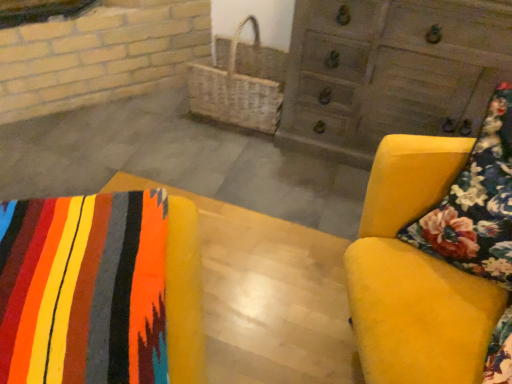
Question: Is woven wicker basket at center oriented towards velvet yellow armchair at right, placed as the 2th furniture when sorted from left to right?

Choices:
 (A) no
 (B) yes

Answer: (A)

Question: Can you confirm if woven wicker basket at center is positioned to the right of velvet yellow armchair at right, placed as the 1th furniture when sorted from right to left?

Choices:
 (A) yes
 (B) no

Answer: (B)

Question: From a real-world perspective, is woven wicker basket at center located beneath velvet yellow armchair at right, placed as the 1th furniture when sorted from right to left?

Choices:
 (A) yes
 (B) no

Answer: (A)

Question: Is woven wicker basket at center positioned before velvet yellow armchair at right, placed as the 1th furniture when sorted from right to left?

Choices:
 (A) no
 (B) yes

Answer: (A)

Question: Is woven wicker basket at center shorter than velvet yellow armchair at right, placed as the 2th furniture when sorted from left to right?

Choices:
 (A) yes
 (B) no

Answer: (A)

Question: Does woven wicker basket at center lie behind velvet yellow armchair at right, placed as the 2th furniture when sorted from left to right?

Choices:
 (A) no
 (B) yes

Answer: (B)

Question: Can you confirm if wooden chest of drawers at upper right is thinner than woven wicker basket at center?

Choices:
 (A) yes
 (B) no

Answer: (B)

Question: Does wooden chest of drawers at upper right have a larger size compared to woven wicker basket at center?

Choices:
 (A) yes
 (B) no

Answer: (A)

Question: Is the position of wooden chest of drawers at upper right less distant than that of woven wicker basket at center?

Choices:
 (A) no
 (B) yes

Answer: (B)

Question: Would you consider wooden chest of drawers at upper right to be distant from woven wicker basket at center?

Choices:
 (A) no
 (B) yes

Answer: (A)

Question: From a real-world perspective, is wooden chest of drawers at upper right positioned under woven wicker basket at center based on gravity?

Choices:
 (A) no
 (B) yes

Answer: (A)

Question: Is wooden chest of drawers at upper right facing away from woven wicker basket at center?

Choices:
 (A) yes
 (B) no

Answer: (B)

Question: Is wooden chest of drawers at upper right at the left side of velvet yellow armchair at right, placed as the 2th furniture when sorted from left to right?

Choices:
 (A) no
 (B) yes

Answer: (A)